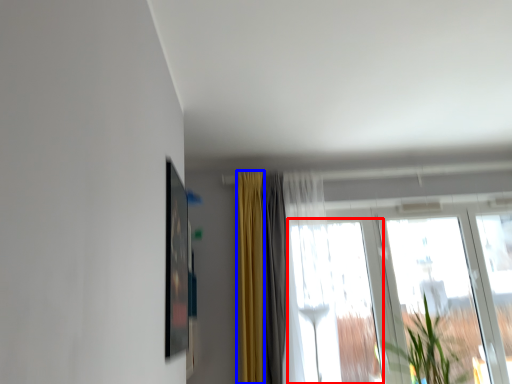
Question: Which point is further to the camera, window (highlighted by a red box) or curtain (highlighted by a blue box)?

Choices:
 (A) window
 (B) curtain

Answer: (B)